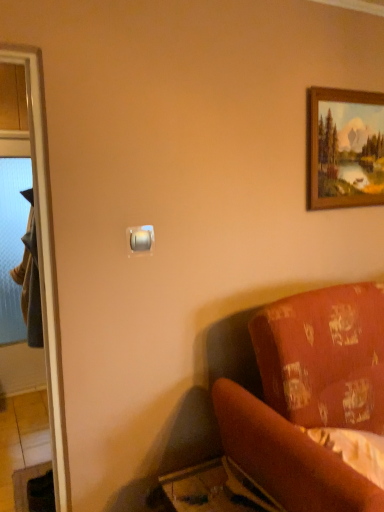
What do you see at coordinates (345, 148) in the screenshot?
I see `wooden picture frame at upper right` at bounding box center [345, 148].

The image size is (384, 512). What do you see at coordinates (310, 397) in the screenshot?
I see `velvet-like red couch at lower right` at bounding box center [310, 397].

Locate an element on the screen. Image resolution: width=384 pixels, height=512 pixels. satin gold switch at upper center is located at coordinates (140, 240).

Find the location of a particular element. The image size is (384, 512). wooden picture frame at upper right is located at coordinates (345, 148).

Where is `robe in front of the satin gold switch at upper center`? This screenshot has width=384, height=512. robe in front of the satin gold switch at upper center is located at coordinates (30, 279).

Considering their positions, is dark gray fabric robe at left located in front of or behind satin gold switch at upper center?

Visually, dark gray fabric robe at left is located in front of satin gold switch at upper center.

Considering the sizes of objects dark gray fabric robe at left and satin gold switch at upper center in the image provided, who is shorter, dark gray fabric robe at left or satin gold switch at upper center?

Standing shorter between the two is satin gold switch at upper center.

From the image's perspective, which is above, dark gray fabric robe at left or satin gold switch at upper center?

satin gold switch at upper center appears higher in the image.

From a real-world perspective, is wooden picture frame at upper right positioned above or below satin gold switch at upper center?

In terms of real-world spatial position, wooden picture frame at upper right is above satin gold switch at upper center.

Is wooden picture frame at upper right thinner than satin gold switch at upper center?

No, wooden picture frame at upper right is not thinner than satin gold switch at upper center.

From the picture: How many degrees apart are the facing directions of wooden picture frame at upper right and satin gold switch at upper center?

They differ by 0.00104 degrees in their facing directions.

Is wooden picture frame at upper right situated inside satin gold switch at upper center or outside?

The correct answer is: outside.

Consider the image. Does dark gray fabric robe at left have a larger size compared to velvet-like red couch at lower right?

Actually, dark gray fabric robe at left might be smaller than velvet-like red couch at lower right.

Can you confirm if dark gray fabric robe at left is positioned to the right of velvet-like red couch at lower right?

No, dark gray fabric robe at left is not to the right of velvet-like red couch at lower right.

Can you tell me how much dark gray fabric robe at left and velvet-like red couch at lower right differ in facing direction?

The angular difference between dark gray fabric robe at left and velvet-like red couch at lower right is 177 degrees.

Between dark gray fabric robe at left and velvet-like red couch at lower right, which one has more height?

Standing taller between the two is velvet-like red couch at lower right.

Who is bigger, satin gold switch at upper center or dark gray fabric robe at left?

dark gray fabric robe at left.

Which is more to the right, satin gold switch at upper center or dark gray fabric robe at left?

From the viewer's perspective, satin gold switch at upper center appears more on the right side.

From a real-world perspective, is satin gold switch at upper center positioned above or below dark gray fabric robe at left?

satin gold switch at upper center is above dark gray fabric robe at left.

Considering the relative positions of velvet-like red couch at lower right and wooden picture frame at upper right in the image provided, is velvet-like red couch at lower right behind wooden picture frame at upper right?

No, velvet-like red couch at lower right is closer to the viewer.

Between velvet-like red couch at lower right and wooden picture frame at upper right, which one has larger size?

velvet-like red couch at lower right.

Is velvet-like red couch at lower right taller or shorter than wooden picture frame at upper right?

Clearly, velvet-like red couch at lower right is taller compared to wooden picture frame at upper right.

In the scene shown: Is velvet-like red couch at lower right positioned far away from wooden picture frame at upper right?

No.

Would you say wooden picture frame at upper right is outside velvet-like red couch at lower right?

wooden picture frame at upper right is positioned outside velvet-like red couch at lower right.

Considering the relative positions of wooden picture frame at upper right and velvet-like red couch at lower right in the image provided, is wooden picture frame at upper right in front of velvet-like red couch at lower right?

No, it is not.

Considering the sizes of wooden picture frame at upper right and velvet-like red couch at lower right in the image, is wooden picture frame at upper right bigger or smaller than velvet-like red couch at lower right?

In the image, wooden picture frame at upper right appears to be smaller than velvet-like red couch at lower right.

Between wooden picture frame at upper right and velvet-like red couch at lower right, which one has larger width?

velvet-like red couch at lower right is wider.

Is there a large distance between satin gold switch at upper center and wooden picture frame at upper right?

Indeed, satin gold switch at upper center is not near wooden picture frame at upper right.

From the image's perspective, is satin gold switch at upper center positioned above or below wooden picture frame at upper right?

satin gold switch at upper center is below wooden picture frame at upper right.

Is satin gold switch at upper center taller than wooden picture frame at upper right?

No, satin gold switch at upper center is not taller than wooden picture frame at upper right.

Where is `light switch to the right of dark gray fabric robe at left`? light switch to the right of dark gray fabric robe at left is located at coordinates click(140, 240).

Identify the location of light switch that appears on the left of wooden picture frame at upper right. (140, 240).

Based on their spatial positions, is wooden picture frame at upper right or satin gold switch at upper center closer to velvet-like red couch at lower right?

Among the two, satin gold switch at upper center is located nearer to velvet-like red couch at lower right.

Estimate the real-world distances between objects in this image. Which object is closer to wooden picture frame at upper right, velvet-like red couch at lower right or dark gray fabric robe at left?

The object closer to wooden picture frame at upper right is velvet-like red couch at lower right.

Looking at the image, which one is located closer to satin gold switch at upper center, dark gray fabric robe at left or wooden picture frame at upper right?

Among the two, wooden picture frame at upper right is located nearer to satin gold switch at upper center.

From the image, which object appears to be nearer to velvet-like red couch at lower right, satin gold switch at upper center or wooden picture frame at upper right?

satin gold switch at upper center.

Based on the photo, considering their positions, is satin gold switch at upper center positioned closer to wooden picture frame at upper right than dark gray fabric robe at left?

satin gold switch at upper center is closer to wooden picture frame at upper right.

Based on their spatial positions, is wooden picture frame at upper right or satin gold switch at upper center closer to dark gray fabric robe at left?

Based on the image, satin gold switch at upper center appears to be nearer to dark gray fabric robe at left.

Looking at this image, which object lies nearer to the anchor point satin gold switch at upper center, wooden picture frame at upper right or dark gray fabric robe at left?

The object closer to satin gold switch at upper center is wooden picture frame at upper right.

When comparing their distances from dark gray fabric robe at left, does velvet-like red couch at lower right or wooden picture frame at upper right seem further?

Among the two, wooden picture frame at upper right is located further to dark gray fabric robe at left.

The image size is (384, 512). I want to click on light switch located between dark gray fabric robe at left and wooden picture frame at upper right in the left-right direction, so click(140, 240).

This screenshot has height=512, width=384. I want to click on light switch located between dark gray fabric robe at left and velvet-like red couch at lower right in the left-right direction, so click(x=140, y=240).

The image size is (384, 512). In order to click on studio couch between dark gray fabric robe at left and wooden picture frame at upper right from left to right in this screenshot , I will do `click(310, 397)`.

Locate an element on the screen. The image size is (384, 512). light switch between wooden picture frame at upper right and velvet-like red couch at lower right in the vertical direction is located at coordinates (140, 240).